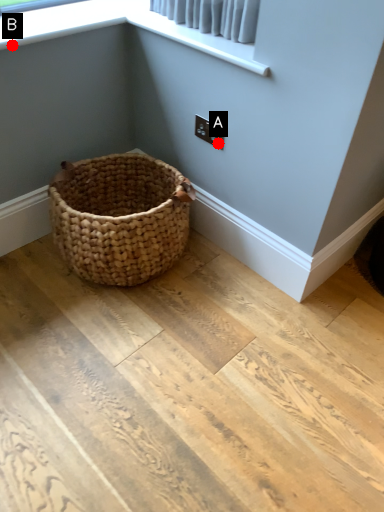
Question: Two points are circled on the image, labeled by A and B beside each circle. Among these points, which one is nearest to the camera?

Choices:
 (A) A is closer
 (B) B is closer

Answer: (B)